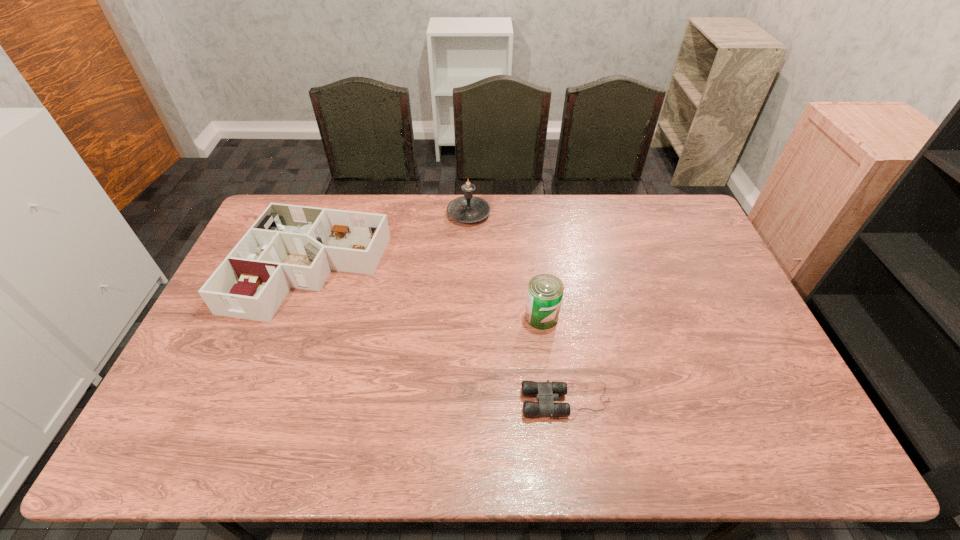
I want to click on free space that is in between the nearest object and the dollhouse, so (439, 335).

The height and width of the screenshot is (540, 960). In order to click on free space between the dollhouse and the candle in this screenshot , I will do `click(390, 241)`.

This screenshot has width=960, height=540. I want to click on free space between the tallest object and the shortest object, so click(x=517, y=307).

Image resolution: width=960 pixels, height=540 pixels. I want to click on free space between the nearest object and the can, so click(x=554, y=359).

Where is `vacant space that's between the tallest object and the shortest object`? Image resolution: width=960 pixels, height=540 pixels. vacant space that's between the tallest object and the shortest object is located at coordinates (517, 307).

Locate an element on the screen. The image size is (960, 540). vacant area between the nearest object and the can is located at coordinates (554, 359).

I want to click on vacant point located between the third shortest object and the leftmost object, so click(426, 293).

Image resolution: width=960 pixels, height=540 pixels. I want to click on free space between the can and the binoculars, so click(554, 359).

The image size is (960, 540). Find the location of `vacant space in between the leftmost object and the binoculars`. vacant space in between the leftmost object and the binoculars is located at coordinates (439, 335).

Locate an element on the screen. The width and height of the screenshot is (960, 540). free space between the can and the second object from left to right is located at coordinates (505, 265).